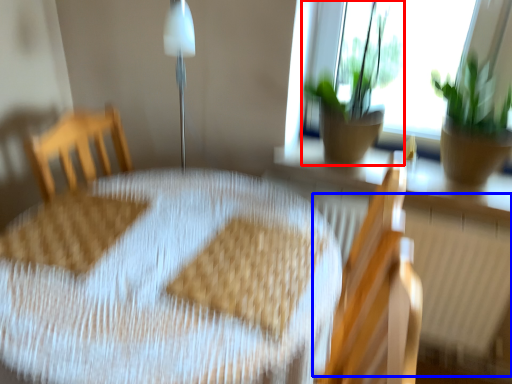
Question: Among these objects, which one is farthest to the camera, houseplant (highlighted by a red box) or radiator (highlighted by a blue box)?

Choices:
 (A) houseplant
 (B) radiator

Answer: (B)